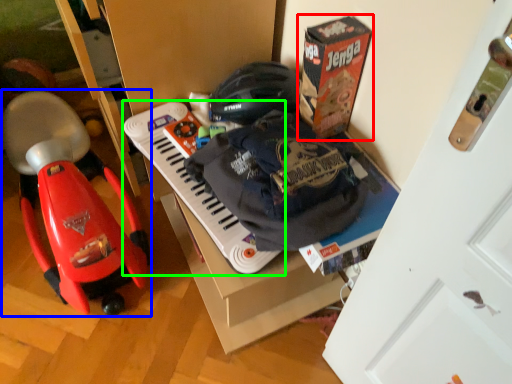
Question: Which is farther away from box (highlighted by a red box)? baby carriage (highlighted by a blue box) or musical keyboard (highlighted by a green box)?

Choices:
 (A) baby carriage
 (B) musical keyboard

Answer: (A)